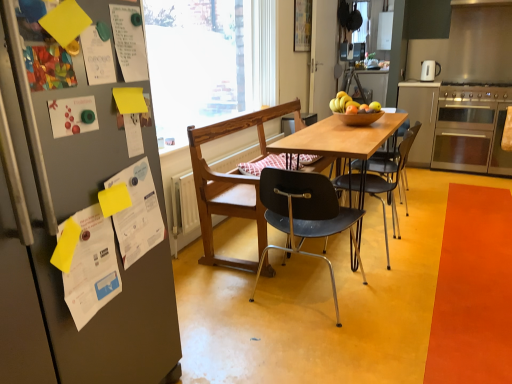
Identify the location of vacant space in front of black plastic chair at center, which appears as the 3th chair when viewed from the back. (323, 344).